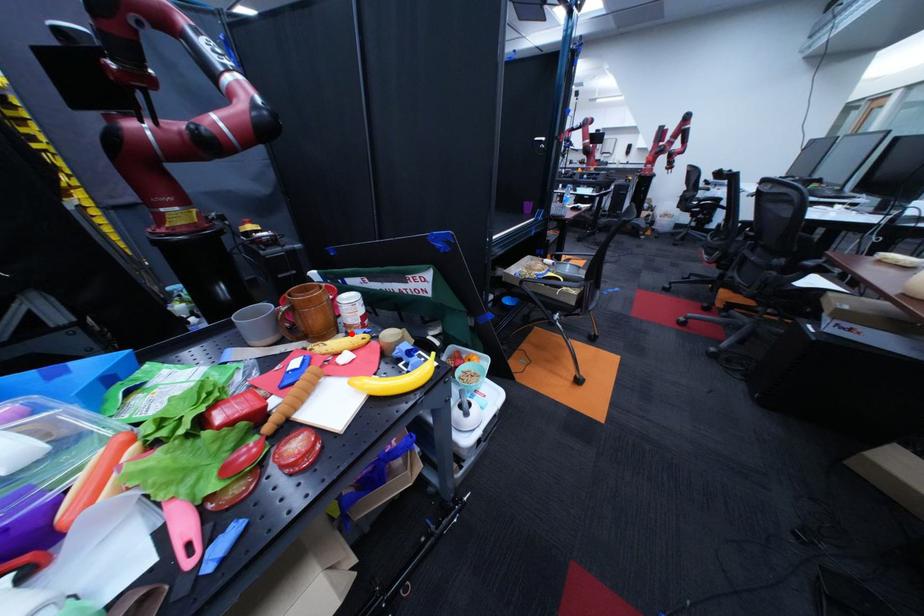
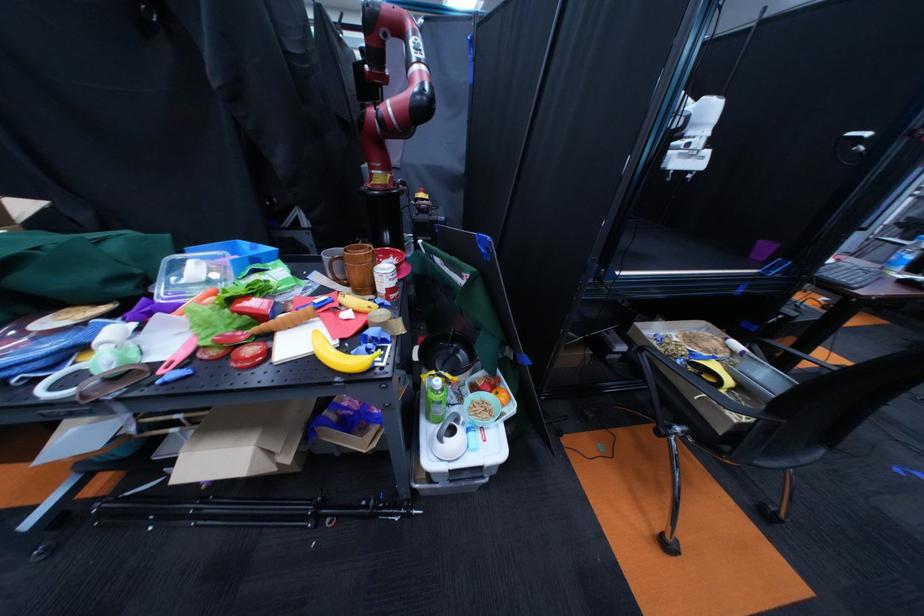
The point at the highlighted location is marked in the first image. Where is the corresponding point in the second image?

(386, 294)